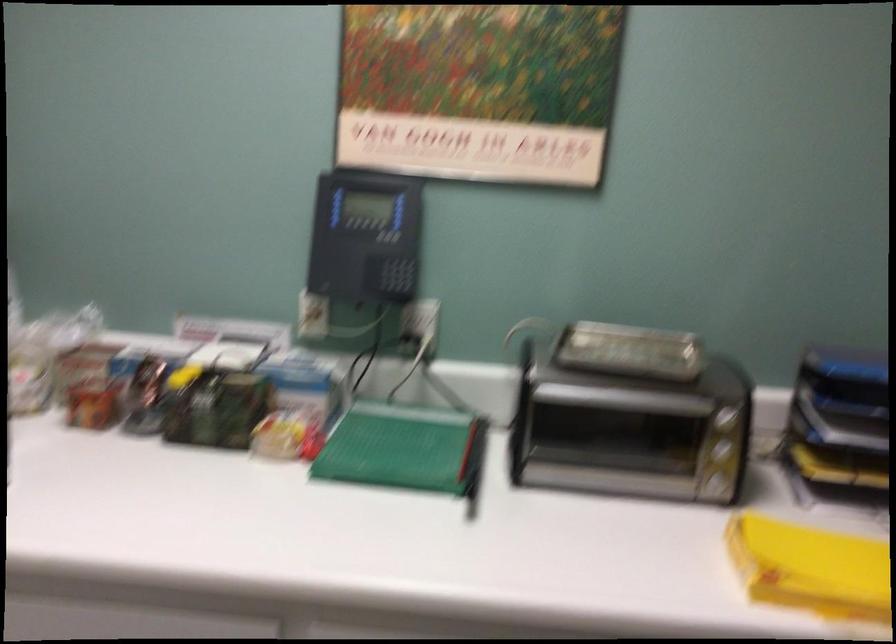
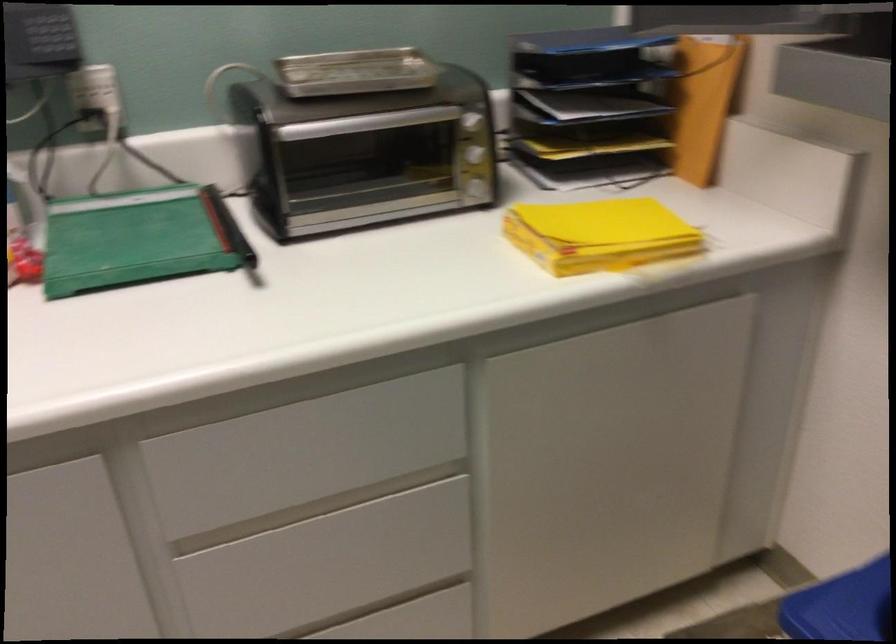
Find the pixel in the second image that matches pixel 621 398 in the first image.

(366, 122)